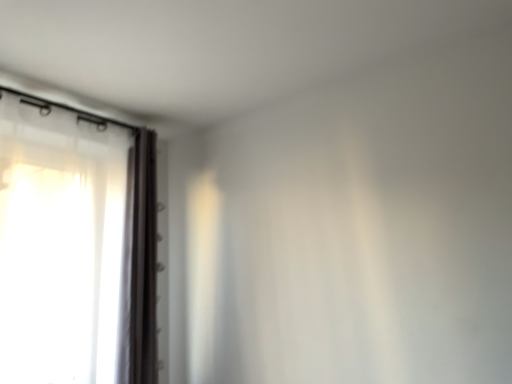
Question: Which is correct: white sheer curtain at left, marked as the second curtain in a left-to-right arrangement, is inside white sheer curtain at left, the 2th curtain when ordered from right to left, or outside of it?

Choices:
 (A) outside
 (B) inside

Answer: (A)

Question: Considering their positions, is white sheer curtain at left, the first curtain in the right-to-left sequence, located in front of or behind white sheer curtain at left, the 2th curtain when ordered from right to left?

Choices:
 (A) behind
 (B) front

Answer: (A)

Question: In terms of size, does white sheer curtain at left, marked as the second curtain in a left-to-right arrangement, appear bigger or smaller than white sheer curtain at left, the first curtain viewed from the left?

Choices:
 (A) big
 (B) small

Answer: (B)

Question: Does point (110, 243) appear closer or farther from the camera than point (142, 230)?

Choices:
 (A) farther
 (B) closer

Answer: (B)

Question: In terms of width, does white sheer curtain at left, the first curtain viewed from the left, look wider or thinner when compared to white sheer curtain at left, the first curtain in the right-to-left sequence?

Choices:
 (A) thin
 (B) wide

Answer: (B)

Question: Considering the positions of white sheer curtain at left, the 2th curtain when ordered from right to left, and white sheer curtain at left, marked as the second curtain in a left-to-right arrangement, in the image, is white sheer curtain at left, the 2th curtain when ordered from right to left, bigger or smaller than white sheer curtain at left, marked as the second curtain in a left-to-right arrangement,?

Choices:
 (A) small
 (B) big

Answer: (B)

Question: Do you think white sheer curtain at left, the 2th curtain when ordered from right to left, is within white sheer curtain at left, marked as the second curtain in a left-to-right arrangement, or outside of it?

Choices:
 (A) outside
 (B) inside

Answer: (A)